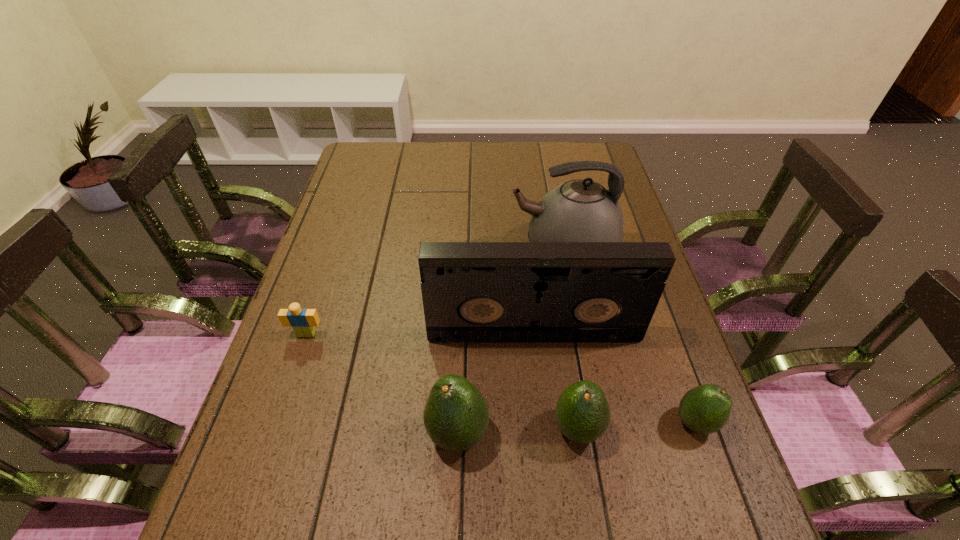
Find the location of a particular element. This screenshot has height=540, width=960. vacant point located between the leftmost avocado and the second avocado from right to left is located at coordinates (517, 431).

Point out which object is positioned as the nearest to the leftmost avocado. Please provide its 2D coordinates. Your answer should be formatted as a tuple, i.e. [(x, y)], where the tuple contains the x and y coordinates of a point satisfying the conditions above.

[(582, 412)]

In order to click on object that ranks as the second closest to the videotape in this screenshot , I will do `click(582, 412)`.

Locate which avocado ranks in proximity to the leftmost avocado. Please provide its 2D coordinates. Your answer should be formatted as a tuple, i.e. [(x, y)], where the tuple contains the x and y coordinates of a point satisfying the conditions above.

[(582, 412)]

This screenshot has width=960, height=540. In order to click on avocado object that ranks as the second closest to the shortest avocado in this screenshot , I will do `click(456, 416)`.

Where is `vacant space that satisfies the following two spatial constraints: 1. on the front side of the second tallest avocado; 2. on the left side of the videotape`? The image size is (960, 540). vacant space that satisfies the following two spatial constraints: 1. on the front side of the second tallest avocado; 2. on the left side of the videotape is located at coordinates coord(543,428).

I want to click on vacant area in the image that satisfies the following two spatial constraints: 1. on the face of the leftmost object; 2. on the right side of the second avocado from right to left, so click(275, 428).

Identify the location of free spot that satisfies the following two spatial constraints: 1. on the front side of the videotape; 2. on the left side of the fifth tallest object. (543, 422).

Locate an element on the screen. This screenshot has width=960, height=540. vacant area in the image that satisfies the following two spatial constraints: 1. at the spout of the kettle; 2. on the front side of the videotape is located at coordinates (581, 334).

At what (x,y) coordinates should I click in order to perform the action: click on blank space that satisfies the following two spatial constraints: 1. on the back side of the shortest avocado; 2. on the right side of the leftmost avocado. Please return your answer as a coordinate pair (x, y). This screenshot has width=960, height=540. Looking at the image, I should click on (459, 422).